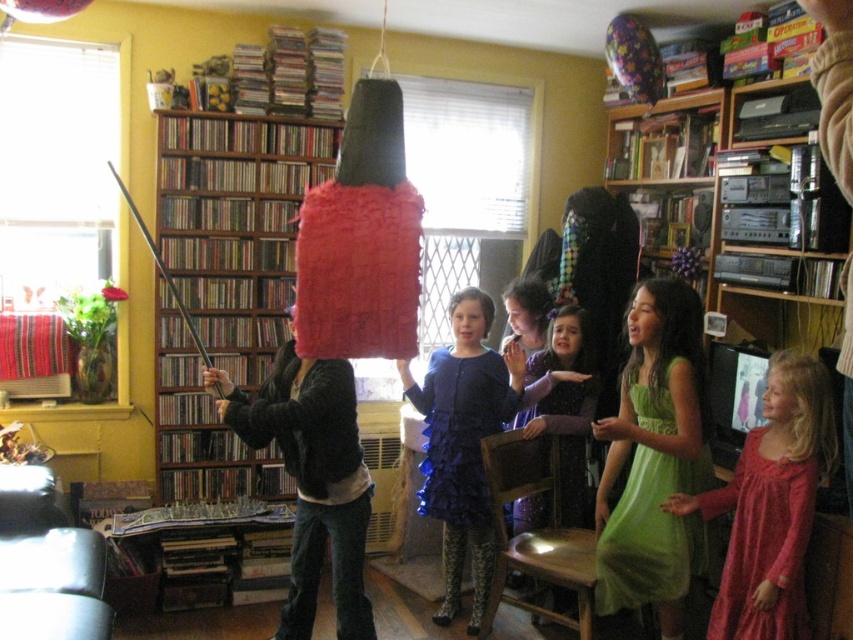
Which of these two, green tulle dress at lower right or velvet purple dress at center, stands shorter?

Standing shorter between the two is velvet purple dress at center.

Is point (608, 438) more distant than point (538, 429)?

No, (608, 438) is closer to viewer.

Where is `green tulle dress at lower right`? green tulle dress at lower right is located at coordinates (654, 458).

Measure the distance between wooden bookshelf at left and green tulle dress at lower right.

The distance of wooden bookshelf at left from green tulle dress at lower right is 5.96 feet.

From the picture: Is wooden bookshelf at left taller than green tulle dress at lower right?

Correct, wooden bookshelf at left is much taller as green tulle dress at lower right.

Find the location of a particular element. The height and width of the screenshot is (640, 853). wooden bookshelf at left is located at coordinates (235, 225).

I want to click on wooden bookshelf at left, so tap(235, 225).

Looking at this image, does wooden bookshelf at left lie in front of velvet purple dress at center?

No.

Which is behind, point (270, 243) or point (558, 602)?

Positioned behind is point (270, 243).

Locate an element on the screen. wooden bookshelf at left is located at coordinates (235, 225).